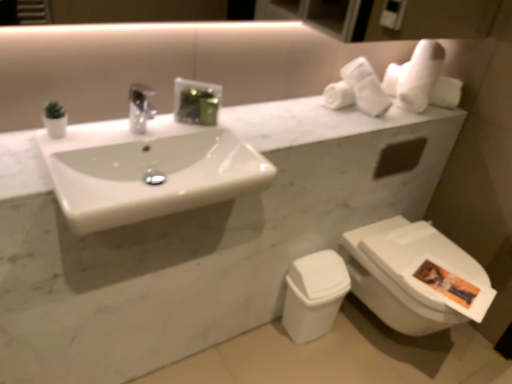
Question: Relative to white soft towel at upper right, is white glossy toilet at lower right in front or behind?

Choices:
 (A) front
 (B) behind

Answer: (A)

Question: From a real-world perspective, is white glossy toilet at lower right physically located above or below white soft towel at upper right?

Choices:
 (A) above
 (B) below

Answer: (B)

Question: Which object is the farthest from the white soft towel at upper right?

Choices:
 (A) white plastic toilet bowl at lower right
 (B) white glossy sink at center
 (C) white glossy toilet at lower right

Answer: (B)

Question: Which object is positioned farthest from the white glossy sink at center?

Choices:
 (A) white glossy toilet at lower right
 (B) white plastic toilet bowl at lower right
 (C) white soft towel at upper right

Answer: (A)